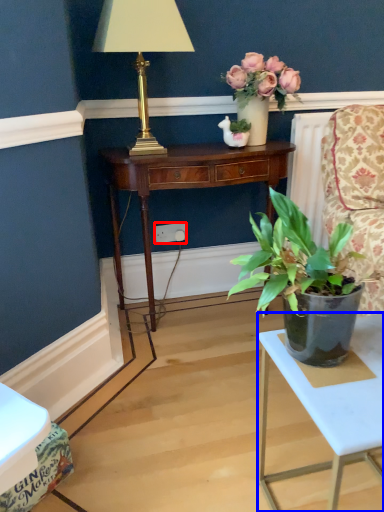
Question: Which point is closer to the camera, power outlet (highlighted by a red box) or table (highlighted by a blue box)?

Choices:
 (A) power outlet
 (B) table

Answer: (B)